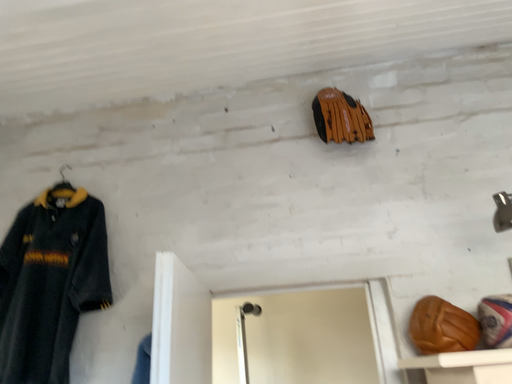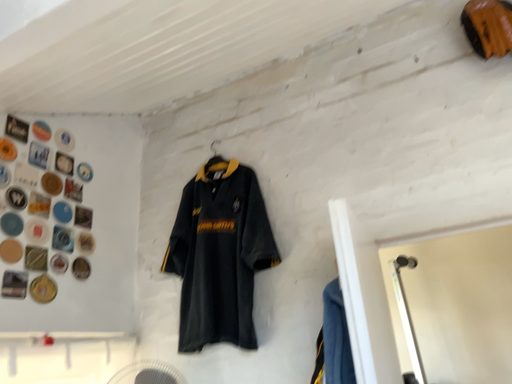
Question: Which way did the camera rotate in the video?

Choices:
 (A) rotated upward
 (B) rotated downward

Answer: (B)